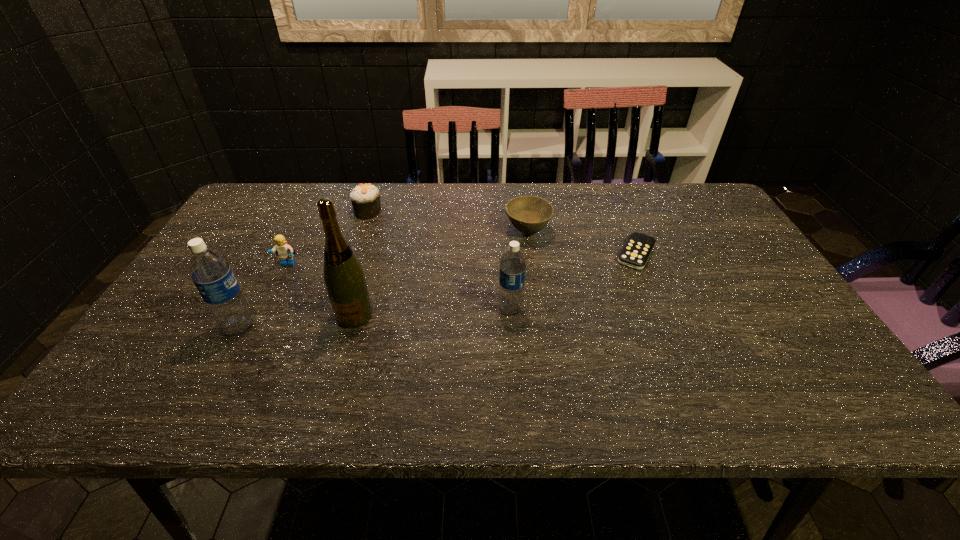
The image size is (960, 540). I want to click on the left water bottle, so click(210, 272).

You are a GUI agent. You are given a task and a screenshot of the screen. Output one action in this format:
    pyautogui.click(x=<x>, y=<y>)
    Task: Click on the second tallest object
    The height and width of the screenshot is (540, 960).
    Given the screenshot: What is the action you would take?
    pyautogui.click(x=210, y=272)

This screenshot has width=960, height=540. I want to click on the shorter water bottle, so click(x=513, y=264).

Image resolution: width=960 pixels, height=540 pixels. What are the coordinates of `the right water bottle` in the screenshot? It's located at (513, 264).

You are a GUI agent. You are given a task and a screenshot of the screen. Output one action in this format:
    pyautogui.click(x=<x>, y=<y>)
    Task: Click on the cupcake
    
    Given the screenshot: What is the action you would take?
    pyautogui.click(x=365, y=198)

I want to click on the rightmost object, so click(635, 253).

This screenshot has height=540, width=960. Find the location of `remote control`. remote control is located at coordinates (635, 253).

Where is `the tallest object`? The width and height of the screenshot is (960, 540). the tallest object is located at coordinates (344, 278).

The width and height of the screenshot is (960, 540). What are the coordinates of `Lego` in the screenshot? It's located at (284, 250).

This screenshot has width=960, height=540. I want to click on bowl, so click(x=528, y=214).